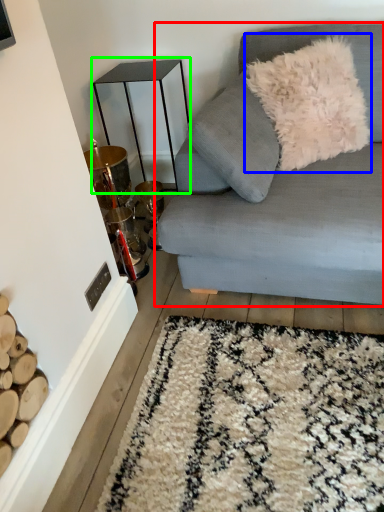
Question: Which is nearer to the studio couch (highlighted by a red box)? throw pillow (highlighted by a blue box) or table (highlighted by a green box).

Choices:
 (A) throw pillow
 (B) table

Answer: (A)